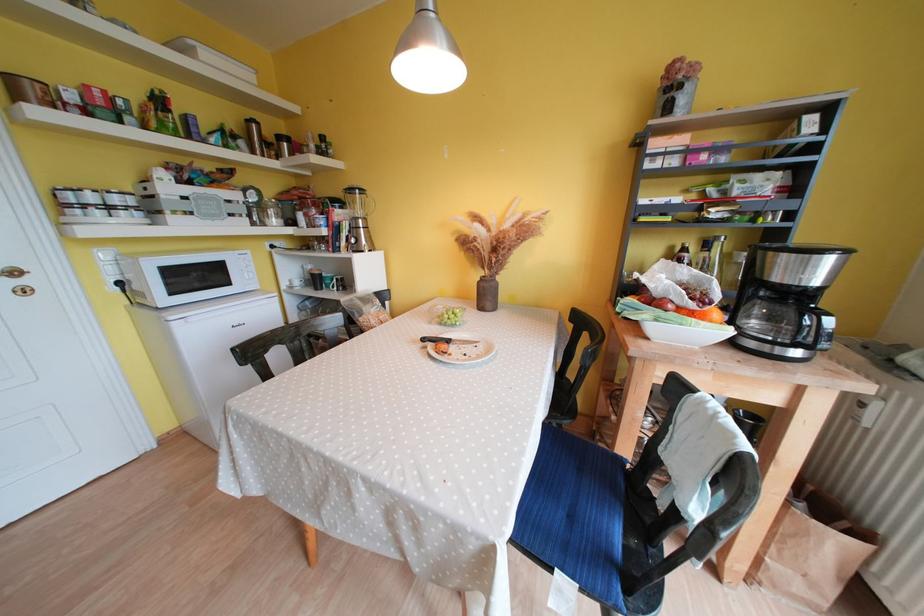
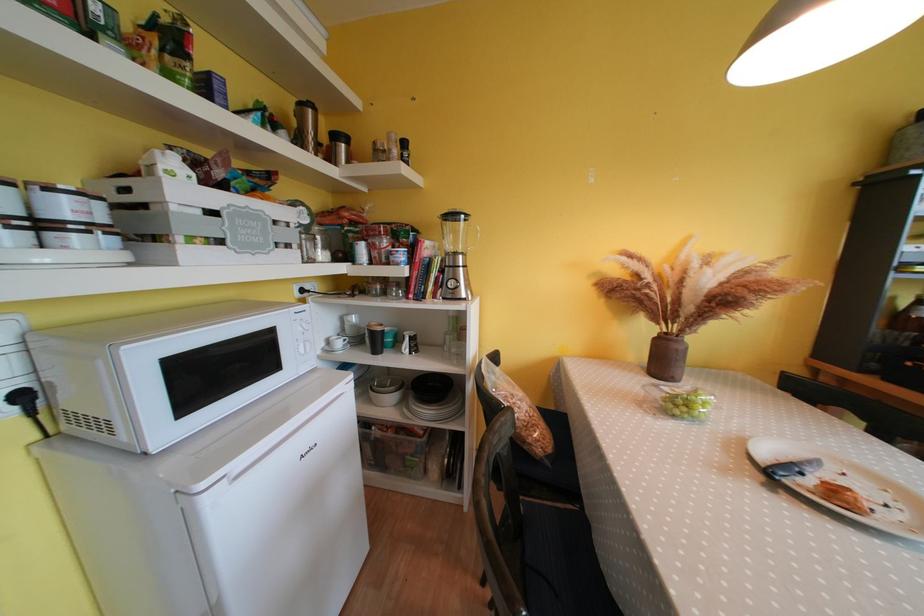
Find the pixel in the second image that matches (x=319, y=278) in the first image.

(379, 337)